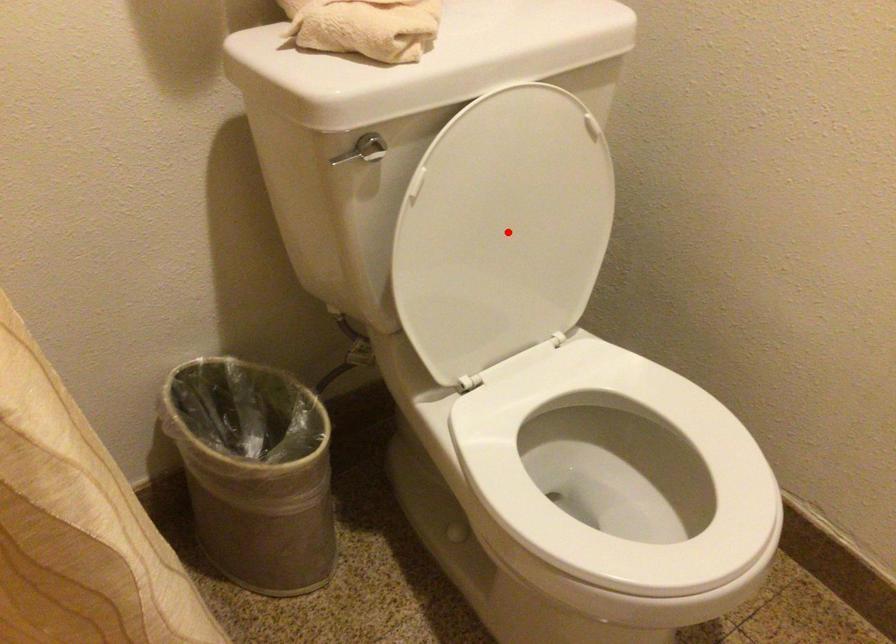
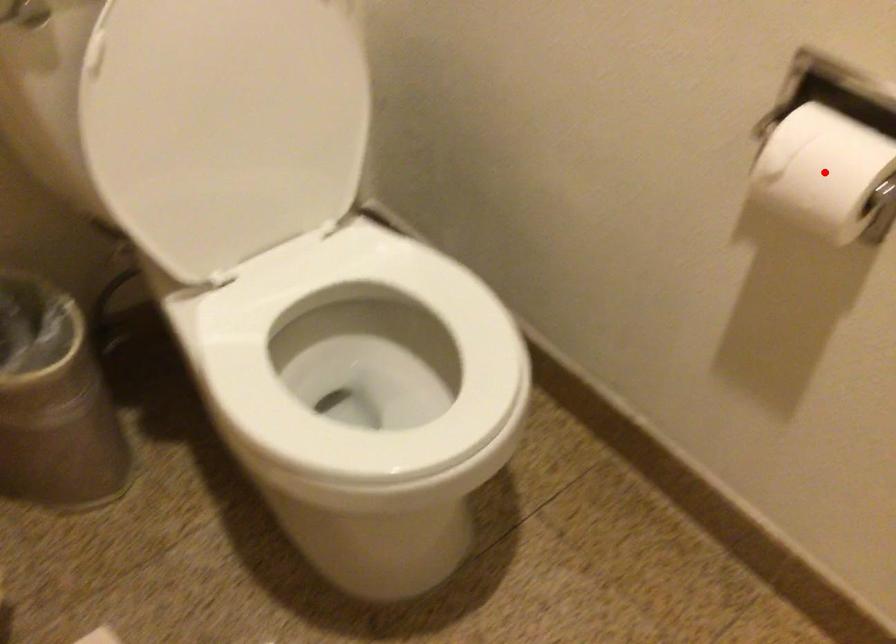
I am providing you with two images of the same scene from different viewpoints. A red point is marked on the first image and another point is marked on the second image. Is the marked point in image1 the same physical position as the marked point in image2?

No